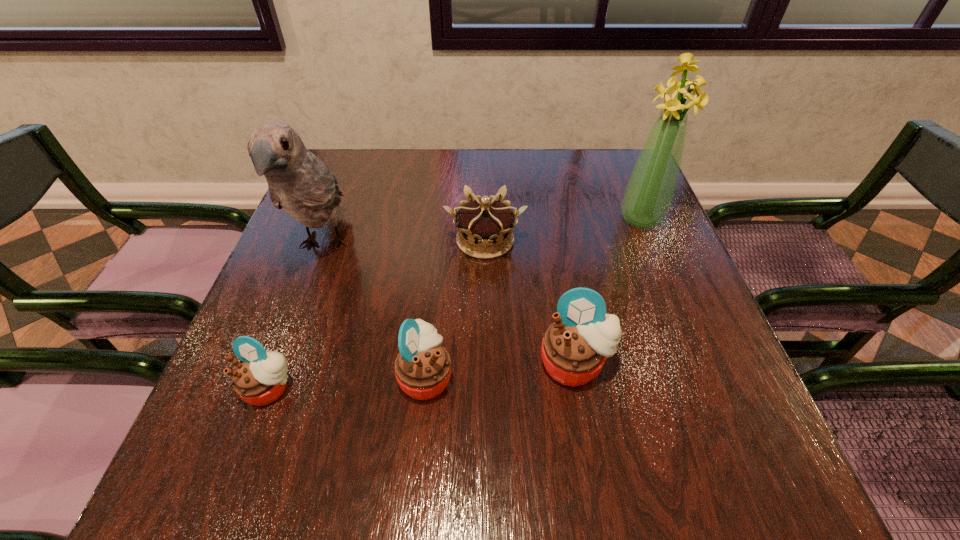
You are a GUI agent. You are given a task and a screenshot of the screen. Output one action in this format:
    pyautogui.click(x=<x>, y=<y>)
    Task: Click on the vacant space situated on the front of the crown
    
    Given the screenshot: What is the action you would take?
    pyautogui.click(x=487, y=345)

Identify the location of vacant region located 0.240m on the front-facing side of the bouquet. The image size is (960, 540). (677, 309).

This screenshot has height=540, width=960. Identify the location of muffin that is at the left edge. (260, 377).

Where is `parrot that is at the left edge`? This screenshot has width=960, height=540. parrot that is at the left edge is located at coordinates (298, 181).

Find the location of `object at the right edge`. object at the right edge is located at coordinates (650, 190).

You are a GUI agent. You are given a task and a screenshot of the screen. Output one action in this format:
    pyautogui.click(x=<x>, y=<y>)
    Task: Click on the object that is at the near left corner
    
    Given the screenshot: What is the action you would take?
    pyautogui.click(x=260, y=377)

In the image, there is a desktop. At what (x,y) coordinates should I click in order to perform the action: click on vacant space at the far edge. Please return your answer as a coordinate pair (x, y). This screenshot has width=960, height=540. Looking at the image, I should click on (391, 165).

Locate an element on the screen. The image size is (960, 540). free region at the near edge of the desktop is located at coordinates (462, 424).

Locate an element on the screen. free space at the left edge is located at coordinates (322, 291).

You are a GUI agent. You are given a task and a screenshot of the screen. Output one action in this format:
    pyautogui.click(x=<x>, y=<y>)
    Task: Click on the vacant space at the right edge of the desktop
    
    Given the screenshot: What is the action you would take?
    pyautogui.click(x=675, y=287)